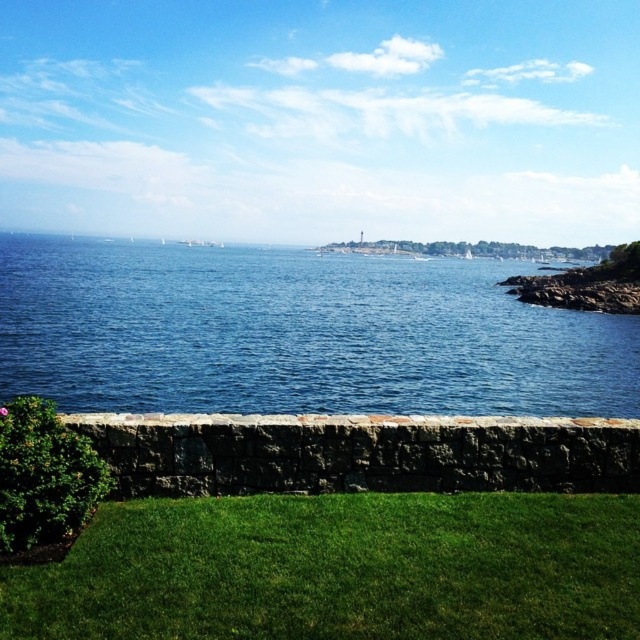
Question: Which object appears farthest from the camera in this image?

Choices:
 (A) green grass at lower center
 (B) blue water at center

Answer: (B)

Question: Is blue water at center positioned at the back of green grass at lower center?

Choices:
 (A) yes
 (B) no

Answer: (A)

Question: Which object is closer to the camera taking this photo?

Choices:
 (A) blue water at center
 (B) green grass at lower center

Answer: (B)

Question: Can you confirm if blue water at center is positioned to the right of green grass at lower center?

Choices:
 (A) yes
 (B) no

Answer: (B)

Question: Is blue water at center positioned before green grass at lower center?

Choices:
 (A) yes
 (B) no

Answer: (B)

Question: Among these points, which one is farthest from the camera?

Choices:
 (A) tap(160, 291)
 (B) tap(636, 522)

Answer: (A)